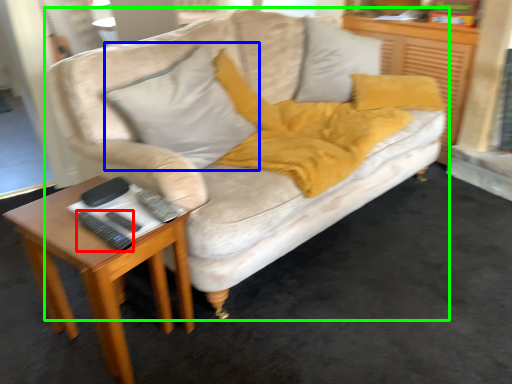
Question: Estimate the real-world distances between objects in this image. Which object is closer to remote (highlighted by a red box), throw pillow (highlighted by a blue box) or studio couch (highlighted by a green box)?

Choices:
 (A) throw pillow
 (B) studio couch

Answer: (A)